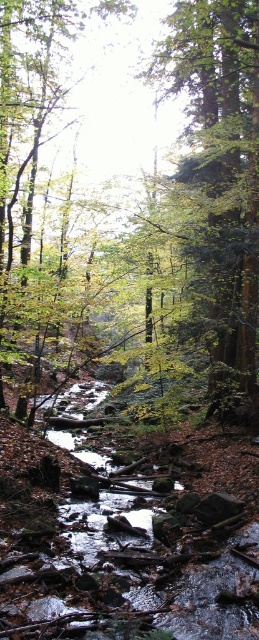
Question: Is green leafy tree at center thinner than green matte tree at center?

Choices:
 (A) no
 (B) yes

Answer: (A)

Question: Does green leafy tree at center appear on the left side of green matte tree at center?

Choices:
 (A) no
 (B) yes

Answer: (B)

Question: From the image, what is the correct spatial relationship of green leafy tree at center in relation to green matte tree at center?

Choices:
 (A) right
 (B) left

Answer: (B)